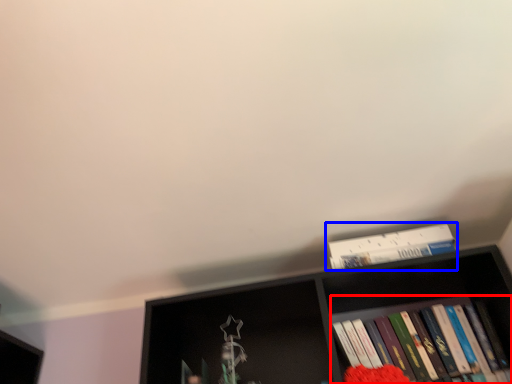
Question: Which of the following is the closest to the observer, book (highlighted by a red box) or book (highlighted by a blue box)?

Choices:
 (A) book
 (B) book

Answer: (A)